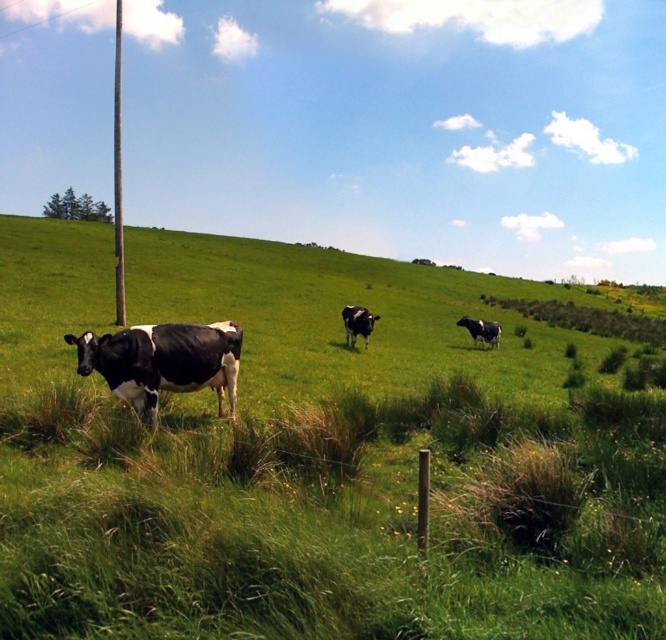
Does black glossy cow at center have a lesser width compared to black and white cow at center?

Incorrect, black glossy cow at center's width is not less than black and white cow at center's.

Who is taller, black glossy cow at center or black and white cow at center?

black glossy cow at center

Identify the location of black glossy cow at center. This screenshot has width=666, height=640. (358, 323).

What do you see at coordinates (163, 362) in the screenshot? Image resolution: width=666 pixels, height=640 pixels. I see `black and white cow at left` at bounding box center [163, 362].

Who is positioned more to the right, black and white cow at left or black glossy cow at center?

black glossy cow at center is more to the right.

Between point (155, 360) and point (348, 339), which one is positioned behind?

The point (348, 339) is behind.

Locate an element on the screen. The image size is (666, 640). black and white cow at left is located at coordinates [163, 362].

Who is positioned more to the left, green grassy at center or black and white cow at center?

Positioned to the left is green grassy at center.

Who is more distant from viewer, (163,532) or (468,326)?

The point (468,326) is more distant.

Which is behind, point (356, 397) or point (462, 324)?

Positioned behind is point (462, 324).

Find the location of a particular element. Image resolution: width=666 pixels, height=640 pixels. green grassy at center is located at coordinates (314, 460).